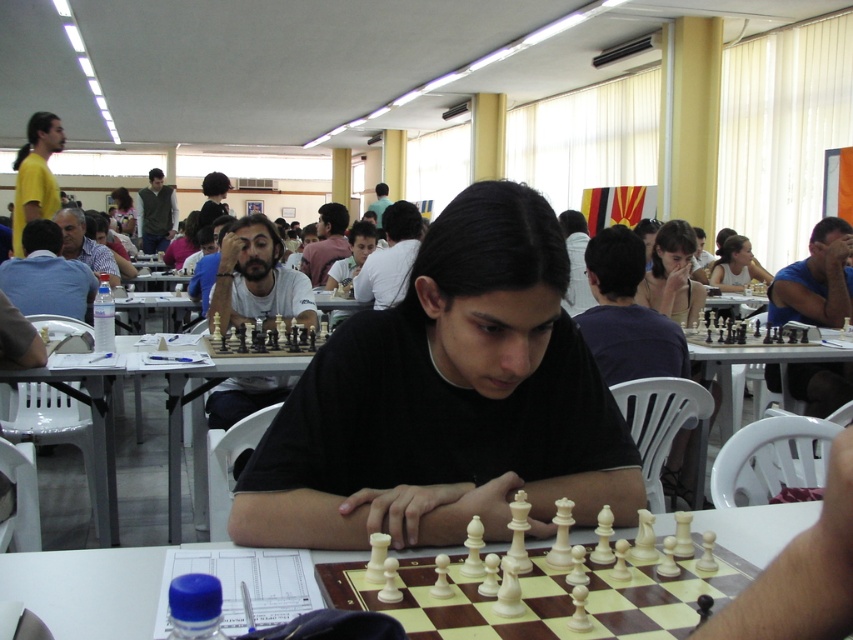
Does white wooden table at center appear over white plastic chess set at center?

Incorrect, white wooden table at center is not positioned above white plastic chess set at center.

Can you confirm if white wooden table at center is shorter than white plastic chess set at center?

Indeed, white wooden table at center has a lesser height compared to white plastic chess set at center.

Which is behind, point (764, 525) or point (285, 332)?

The point (285, 332) is more distant.

Identify the location of white wooden table at center. (86, 589).

Is yellow matte shirt at upper left smaller than dark brown hair at center?

Incorrect, yellow matte shirt at upper left is not smaller in size than dark brown hair at center.

Does yellow matte shirt at upper left appear on the left side of dark brown hair at center?

Correct, you'll find yellow matte shirt at upper left to the left of dark brown hair at center.

The image size is (853, 640). I want to click on yellow matte shirt at upper left, so click(x=35, y=173).

From the picture: Does black matte shirt at center have a smaller size compared to matte white chess piece at center?

Indeed, black matte shirt at center has a smaller size compared to matte white chess piece at center.

Looking at this image, is black matte shirt at center thinner than matte white chess piece at center?

No, black matte shirt at center is not thinner than matte white chess piece at center.

This screenshot has height=640, width=853. Identify the location of black matte shirt at center. (447, 401).